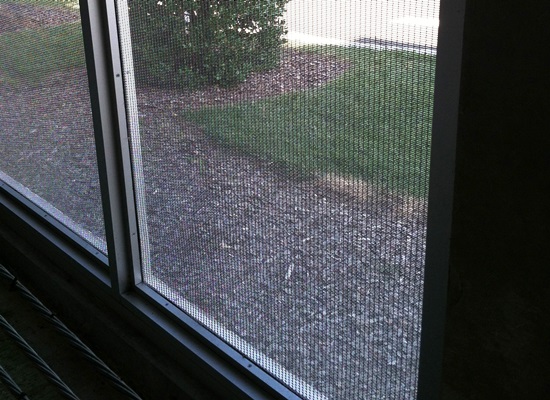
Locate an element on the screen. 2 white window bars is located at coordinates (438, 262), (109, 182).